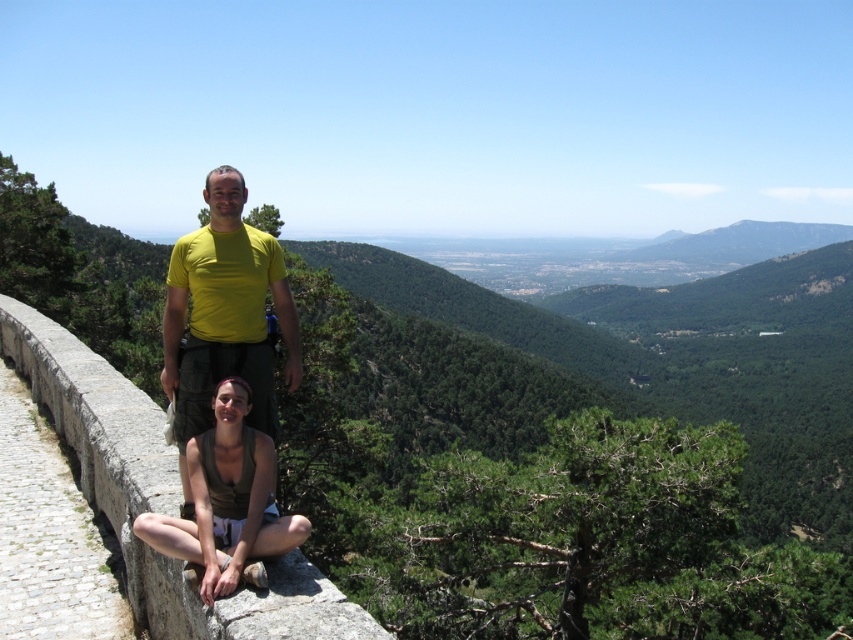
You are a photographer trying to capture a wide shot of the gray stone ledge at center and the green fabric tank top at lower center. Since you want both objects to be clearly visible in the frame, which object should you focus on first to ensure proper depth of field?

The gray stone ledge at center has a larger size compared to the green fabric tank top at lower center, so you should focus on the gray stone ledge at center first to ensure both are in focus.